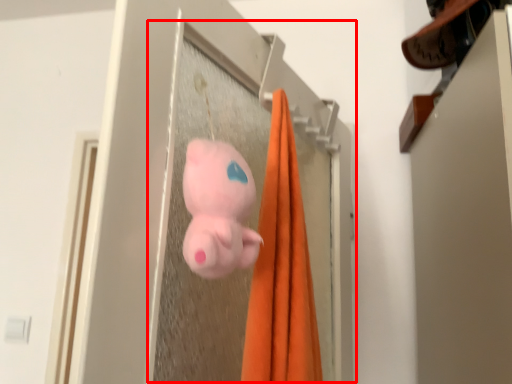
Question: From the image's perspective, what is the correct spatial relationship of screen door (annotated by the red box) in relation to toy?

Choices:
 (A) above
 (B) below

Answer: (A)